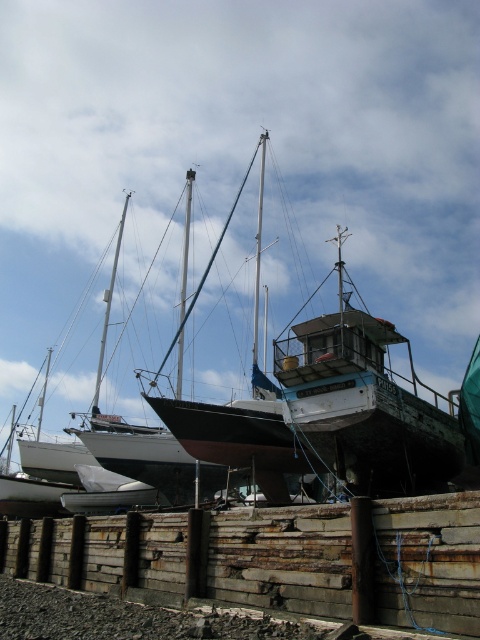
Question: Which point is closer to the camera?

Choices:
 (A) black matte sailboat at center
 (B) rusty metal boat at center
 (C) rusty wood dock at lower center

Answer: (C)

Question: Can you confirm if rusty wood dock at lower center is smaller than rusty metal boat at center?

Choices:
 (A) yes
 (B) no

Answer: (A)

Question: Which object appears farthest from the camera in this image?

Choices:
 (A) black matte sailboat at center
 (B) rusty wood dock at lower center
 (C) rusty metal boat at center

Answer: (A)

Question: Does rusty wood dock at lower center have a greater width compared to rusty metal boat at center?

Choices:
 (A) no
 (B) yes

Answer: (A)

Question: Is rusty wood dock at lower center further to the viewer compared to rusty metal boat at center?

Choices:
 (A) no
 (B) yes

Answer: (A)

Question: Which of the following is the closest to the observer?

Choices:
 (A) black matte sailboat at center
 (B) rusty metal boat at center

Answer: (B)